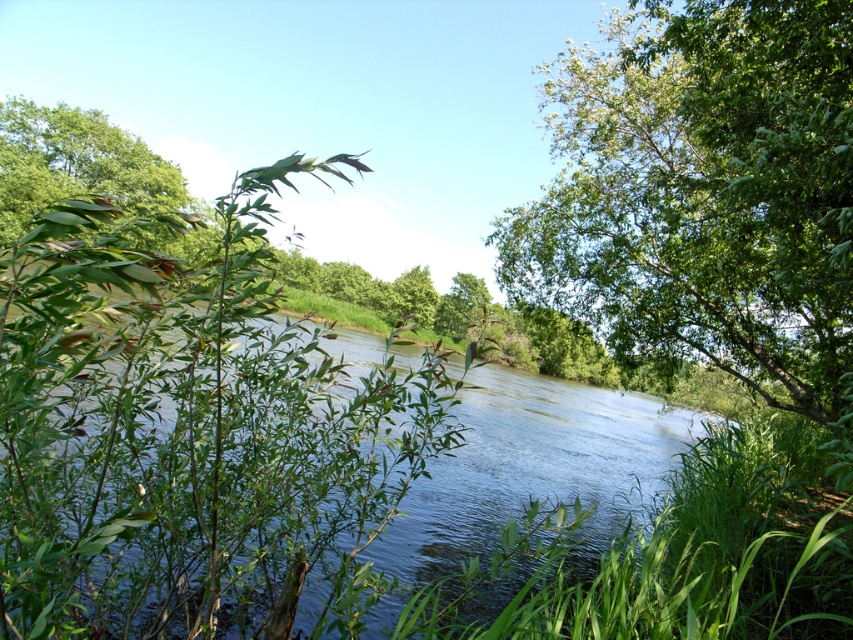
Question: Is green leafy river at center to the right of green leafy tree at center from the viewer's perspective?

Choices:
 (A) yes
 (B) no

Answer: (B)

Question: Considering the relative positions of green leafy river at center and green leafy tree at upper left in the image provided, where is green leafy river at center located with respect to green leafy tree at upper left?

Choices:
 (A) right
 (B) left

Answer: (A)

Question: Is green leafy river at center behind green leafy tree at upper left?

Choices:
 (A) no
 (B) yes

Answer: (A)

Question: Estimate the real-world distances between objects in this image. Which object is closer to the green leafy river at center?

Choices:
 (A) green leafy tree at upper left
 (B) green leafy tree at center

Answer: (B)

Question: Which is farther from the green leafy tree at upper left?

Choices:
 (A) green leafy river at center
 (B) green leafy tree at center

Answer: (B)

Question: Based on their relative distances, which object is farther from the green leafy tree at center?

Choices:
 (A) green leafy tree at upper left
 (B) green leafy river at center

Answer: (A)